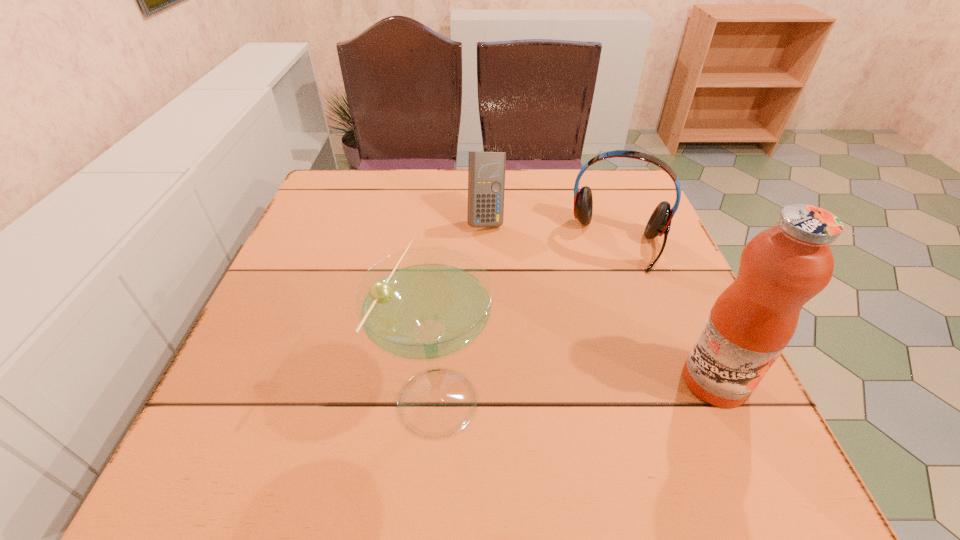
I want to click on free region located with the microphone attached to the side of the headset, so (x=583, y=398).

Identify the location of calculator at the far edge. The image size is (960, 540). (486, 170).

The width and height of the screenshot is (960, 540). Find the location of `headset that is at the far edge`. headset that is at the far edge is located at coordinates (659, 223).

At what (x,y) coordinates should I click in order to perform the action: click on martini that is at the near edge. Please return your answer as a coordinate pair (x, y). Looking at the image, I should click on (425, 304).

Identify the location of fruit juice present at the near edge. (781, 268).

Locate an element on the screen. Image resolution: width=960 pixels, height=540 pixels. fruit juice present at the right edge is located at coordinates (781, 268).

Find the location of a particular element. This screenshot has width=960, height=540. headset that is at the right edge is located at coordinates (659, 223).

Locate an element on the screen. This screenshot has height=540, width=960. object at the far right corner is located at coordinates (659, 223).

Find the location of a particular element. This screenshot has width=960, height=540. object that is at the near right corner is located at coordinates (781, 268).

The image size is (960, 540). I want to click on vacant space at the far edge of the desktop, so click(519, 207).